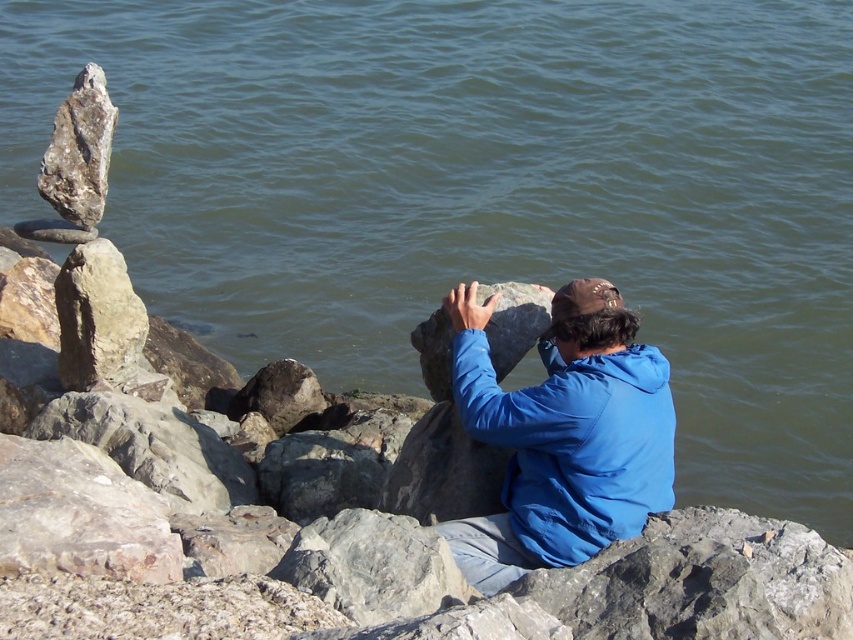
You are a photographer trying to capture the person in the blue fabric jacket at center and the gray rough rock at center in a single shot. Which object should you focus on first if you want to ensure both are in clear focus?

The blue fabric jacket at center is taller than the gray rough rock at center, so focusing on the taller object first will help ensure both are in clear focus.

You are standing at the point labeled as point (502, 323) and want to walk towards the point labeled as point (415, 609). Based on the scene description, will you be moving towards the water or away from it?

Based on the scene description, point (415, 609) is in front of point (502, 323). Since the person is facing the water, moving towards the point (415, 609) would mean moving in the direction the person is facing, which is towards the water.